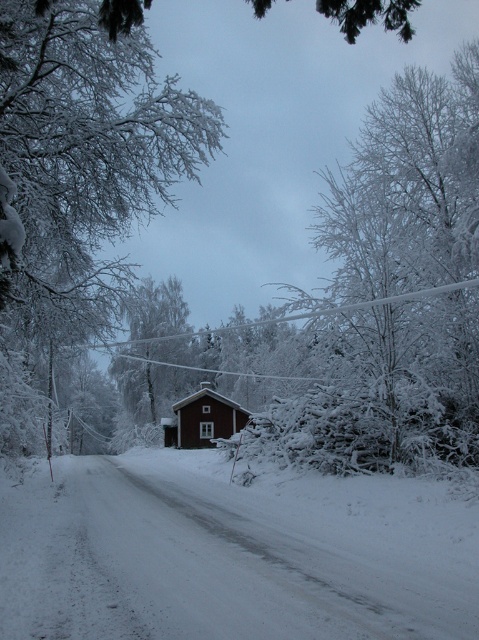
Question: Which point is closer to the camera?

Choices:
 (A) (185, 440)
 (B) (49, 397)
 (C) (363, 563)

Answer: (C)

Question: Is white fluffy snow at center below red wooden house at center?

Choices:
 (A) yes
 (B) no

Answer: (B)

Question: From the image, what is the correct spatial relationship of white fluffy snow at center in relation to white frosty branches at center?

Choices:
 (A) below
 (B) above

Answer: (A)

Question: Which point is closer to the camera taking this photo?

Choices:
 (A) (216, 406)
 (B) (174, 100)
 (C) (257, 632)

Answer: (C)

Question: Which point is closer to the camera taking this photo?

Choices:
 (A) (4, 292)
 (B) (422, 618)
 (C) (185, 448)

Answer: (B)

Question: Does white fluffy snow at center appear over red wooden house at center?

Choices:
 (A) yes
 (B) no

Answer: (A)